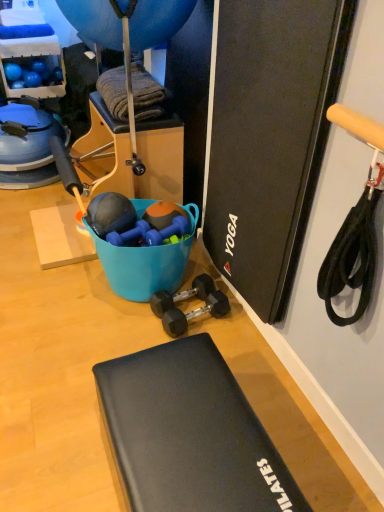
What do you see at coordinates (189, 434) in the screenshot?
I see `black rubber exercise mat at lower center` at bounding box center [189, 434].

Locate an element on the screen. The height and width of the screenshot is (512, 384). blue rubber balloon at upper center is located at coordinates (128, 20).

Find the location of a particular element. black rubber dumbbell at center, marked as the third dumbbell in a top-to-bottom arrangement is located at coordinates (195, 314).

Is blue rubber dumbbell at center, placed as the 3th dumbbell when sorted from bottom to top, closer to the viewer compared to black rubber dumbbell at center, which is counted as the 1th dumbbell, starting from the bottom?

No, blue rubber dumbbell at center, placed as the 3th dumbbell when sorted from bottom to top, is behind black rubber dumbbell at center, which is counted as the 1th dumbbell, starting from the bottom.

Does blue rubber dumbbell at center, placed as the 3th dumbbell when sorted from bottom to top, have a greater height compared to black rubber dumbbell at center, marked as the third dumbbell in a top-to-bottom arrangement?

Incorrect, the height of blue rubber dumbbell at center, placed as the 3th dumbbell when sorted from bottom to top, is not larger of that of black rubber dumbbell at center, marked as the third dumbbell in a top-to-bottom arrangement.

In terms of size, does blue rubber dumbbell at center, placed as the 3th dumbbell when sorted from bottom to top, appear bigger or smaller than black rubber dumbbell at center, which is counted as the 1th dumbbell, starting from the bottom?

In the image, blue rubber dumbbell at center, placed as the 3th dumbbell when sorted from bottom to top, appears to be smaller than black rubber dumbbell at center, which is counted as the 1th dumbbell, starting from the bottom.

Would you say blue rubber dumbbell at center, placed as the 3th dumbbell when sorted from bottom to top, is outside black rubber dumbbell at center, which is counted as the 1th dumbbell, starting from the bottom?

Indeed, blue rubber dumbbell at center, placed as the 3th dumbbell when sorted from bottom to top, is completely outside black rubber dumbbell at center, which is counted as the 1th dumbbell, starting from the bottom.

From the image's perspective, is blue rubber dumbbell at center, placed as the first dumbbell when sorted from top to bottom, located above black rubber exercise mat at lower center?

Yes, from the image's perspective, blue rubber dumbbell at center, placed as the first dumbbell when sorted from top to bottom, is over black rubber exercise mat at lower center.

From the picture: Is the position of blue rubber dumbbell at center, placed as the 3th dumbbell when sorted from bottom to top, less distant than that of black rubber exercise mat at lower center?

No.

Are blue rubber dumbbell at center, placed as the first dumbbell when sorted from top to bottom, and black rubber exercise mat at lower center far apart?

blue rubber dumbbell at center, placed as the first dumbbell when sorted from top to bottom, is near black rubber exercise mat at lower center, not far away.

Is blue rubber dumbbell at center, placed as the 3th dumbbell when sorted from bottom to top, at the left side of black rubber exercise mat at lower center?

Indeed, blue rubber dumbbell at center, placed as the 3th dumbbell when sorted from bottom to top, is positioned on the left side of black rubber exercise mat at lower center.

Is black rubber exercise mat at lower center wider than black rubber dumbbell at center, marked as the third dumbbell in a top-to-bottom arrangement?

Indeed, black rubber exercise mat at lower center has a greater width compared to black rubber dumbbell at center, marked as the third dumbbell in a top-to-bottom arrangement.

From a real-world perspective, which object stands above the other?

black rubber exercise mat at lower center.

Looking at this image, is black rubber exercise mat at lower center not close to black rubber dumbbell at center, marked as the third dumbbell in a top-to-bottom arrangement?

No, black rubber exercise mat at lower center is not far from black rubber dumbbell at center, marked as the third dumbbell in a top-to-bottom arrangement.

Is black rubber dumbbell at center, marked as the third dumbbell in a top-to-bottom arrangement, a part of black rubber exercise mat at lower center?

No, black rubber dumbbell at center, marked as the third dumbbell in a top-to-bottom arrangement, is not surrounded by black rubber exercise mat at lower center.

Is point (200, 285) more distant than point (273, 471)?

Yes.

Is black rubber exercise mat at lower center surrounded by black rubber dumbbells at center, which is the 2th dumbbell from bottom to top?

No, black rubber exercise mat at lower center is not inside black rubber dumbbells at center, which is the 2th dumbbell from bottom to top.

Which is in front, black rubber dumbbells at center, arranged as the 2th dumbbell when viewed from the top, or black rubber exercise mat at lower center?

black rubber exercise mat at lower center is closer to the camera.

Who is smaller, black rubber dumbbells at center, which is the 2th dumbbell from bottom to top, or black rubber exercise mat at lower center?

black rubber dumbbells at center, which is the 2th dumbbell from bottom to top, is smaller.

Is black rubber dumbbell at center, which is counted as the 1th dumbbell, starting from the bottom, shorter than blue rubber balloon at upper center?

Correct, black rubber dumbbell at center, which is counted as the 1th dumbbell, starting from the bottom, is not as tall as blue rubber balloon at upper center.

Is black rubber dumbbell at center, marked as the third dumbbell in a top-to-bottom arrangement, facing towards blue rubber balloon at upper center?

No.

Based on their sizes in the image, would you say black rubber dumbbell at center, which is counted as the 1th dumbbell, starting from the bottom, is bigger or smaller than blue rubber balloon at upper center?

In the image, black rubber dumbbell at center, which is counted as the 1th dumbbell, starting from the bottom, appears to be smaller than blue rubber balloon at upper center.

From a real-world perspective, which object stands above the other?

In real-world perspective, blue rubber balloon at upper center is above.

Considering the positions of points (149, 225) and (162, 36), is point (149, 225) closer to camera compared to point (162, 36)?

That is False.

Does blue rubber dumbbell at center, placed as the 3th dumbbell when sorted from bottom to top, turn towards blue rubber balloon at upper center?

No, blue rubber dumbbell at center, placed as the 3th dumbbell when sorted from bottom to top, does not turn towards blue rubber balloon at upper center.

Looking at this image, can you confirm if blue rubber dumbbell at center, placed as the 3th dumbbell when sorted from bottom to top, is bigger than blue rubber balloon at upper center?

Incorrect, blue rubber dumbbell at center, placed as the 3th dumbbell when sorted from bottom to top, is not larger than blue rubber balloon at upper center.

From a real-world perspective, is blue rubber dumbbell at center, placed as the 3th dumbbell when sorted from bottom to top, physically located above or below blue rubber balloon at upper center?

blue rubber dumbbell at center, placed as the 3th dumbbell when sorted from bottom to top, is below blue rubber balloon at upper center.

The height and width of the screenshot is (512, 384). Identify the location of the 3rd dumbbell behind the black rubber exercise mat at lower center. (181, 295).

Choose the correct answer: Is black rubber exercise mat at lower center inside black rubber dumbbells at center, which is the 2th dumbbell from bottom to top, or outside it?

black rubber exercise mat at lower center is not enclosed by black rubber dumbbells at center, which is the 2th dumbbell from bottom to top.

Is black rubber exercise mat at lower center beside black rubber dumbbells at center, which is the 2th dumbbell from bottom to top?

black rubber exercise mat at lower center and black rubber dumbbells at center, which is the 2th dumbbell from bottom to top, are not in contact.

Is black rubber exercise mat at lower center looking in the opposite direction of black rubber dumbbells at center, arranged as the 2th dumbbell when viewed from the top?

No, black rubber exercise mat at lower center's orientation is not away from black rubber dumbbells at center, arranged as the 2th dumbbell when viewed from the top.

There is a black rubber dumbbell at center, which is counted as the 1th dumbbell, starting from the bottom. Where is `dumbbell above it (from a real-world perspective)`? dumbbell above it (from a real-world perspective) is located at coordinates (130, 234).

Locate an element on the screen. Image resolution: width=384 pixels, height=512 pixels. furniture in front of the blue rubber dumbbell at center, placed as the first dumbbell when sorted from top to bottom is located at coordinates (189, 434).

When comparing their distances from black rubber exercise mat at lower center, does black rubber dumbbells at center, arranged as the 2th dumbbell when viewed from the top, or black rubber dumbbell at center, marked as the third dumbbell in a top-to-bottom arrangement, seem closer?

Based on the image, black rubber dumbbell at center, marked as the third dumbbell in a top-to-bottom arrangement, appears to be nearer to black rubber exercise mat at lower center.

Which object lies nearer to the anchor point black rubber exercise mat at lower center, blue rubber balloon at upper center or black rubber dumbbell at center, marked as the third dumbbell in a top-to-bottom arrangement?

black rubber dumbbell at center, marked as the third dumbbell in a top-to-bottom arrangement, is positioned closer to the anchor black rubber exercise mat at lower center.

Considering their positions, is blue rubber balloon at upper center positioned further to blue rubber dumbbell at center, placed as the 3th dumbbell when sorted from bottom to top, than black rubber dumbbell at center, marked as the third dumbbell in a top-to-bottom arrangement?

The object further to blue rubber dumbbell at center, placed as the 3th dumbbell when sorted from bottom to top, is blue rubber balloon at upper center.

From the image, which object appears to be nearer to blue rubber dumbbell at center, placed as the first dumbbell when sorted from top to bottom, black rubber exercise mat at lower center or black rubber dumbbells at center, arranged as the 2th dumbbell when viewed from the top?

black rubber dumbbells at center, arranged as the 2th dumbbell when viewed from the top, lies closer to blue rubber dumbbell at center, placed as the first dumbbell when sorted from top to bottom, than the other object.

Estimate the real-world distances between objects in this image. Which object is closer to black rubber dumbbells at center, arranged as the 2th dumbbell when viewed from the top, blue rubber dumbbell at center, placed as the first dumbbell when sorted from top to bottom, or blue rubber balloon at upper center?

blue rubber dumbbell at center, placed as the first dumbbell when sorted from top to bottom.

From the picture: Considering their positions, is black rubber dumbbell at center, which is counted as the 1th dumbbell, starting from the bottom, positioned closer to blue rubber dumbbell at center, placed as the first dumbbell when sorted from top to bottom, than black rubber dumbbells at center, arranged as the 2th dumbbell when viewed from the top?

black rubber dumbbells at center, arranged as the 2th dumbbell when viewed from the top, lies closer to blue rubber dumbbell at center, placed as the first dumbbell when sorted from top to bottom, than the other object.

Considering their positions, is black rubber dumbbells at center, arranged as the 2th dumbbell when viewed from the top, positioned further to blue rubber balloon at upper center than blue rubber dumbbell at center, placed as the first dumbbell when sorted from top to bottom?

black rubber dumbbells at center, arranged as the 2th dumbbell when viewed from the top.

Which object lies nearer to the anchor point black rubber dumbbells at center, arranged as the 2th dumbbell when viewed from the top, blue rubber balloon at upper center or black rubber dumbbell at center, marked as the third dumbbell in a top-to-bottom arrangement?

black rubber dumbbell at center, marked as the third dumbbell in a top-to-bottom arrangement, is closer to black rubber dumbbells at center, arranged as the 2th dumbbell when viewed from the top.

This screenshot has width=384, height=512. I want to click on dumbbell between black rubber exercise mat at lower center and blue rubber dumbbell at center, placed as the 3th dumbbell when sorted from bottom to top, in the front-back direction, so click(x=195, y=314).

Find the location of a particular element. dumbbell that lies between blue rubber dumbbell at center, placed as the 3th dumbbell when sorted from bottom to top, and black rubber dumbbell at center, which is counted as the 1th dumbbell, starting from the bottom, from top to bottom is located at coordinates (181, 295).

Where is `dumbbell between blue rubber balloon at upper center and black rubber dumbbells at center, which is the 2th dumbbell from bottom to top, in the up-down direction`? The image size is (384, 512). dumbbell between blue rubber balloon at upper center and black rubber dumbbells at center, which is the 2th dumbbell from bottom to top, in the up-down direction is located at coordinates (130, 234).